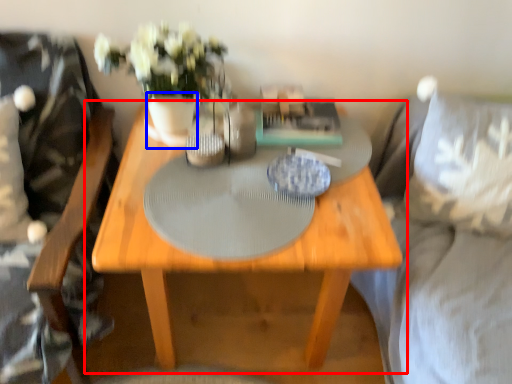
Question: Which point is further to the camera, table (highlighted by a red box) or vase (highlighted by a blue box)?

Choices:
 (A) table
 (B) vase

Answer: (B)